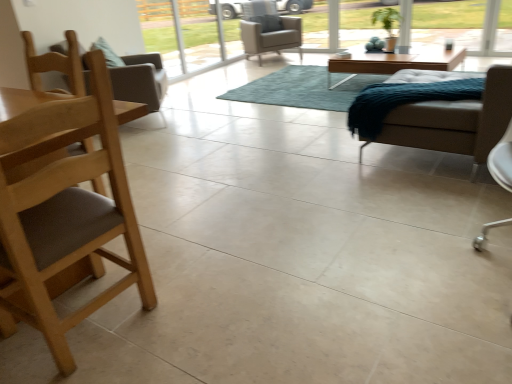
Question: Can you confirm if teal shaggy rug at center is smaller than light brown leather armchair at center, the 1th chair when ordered from back to front?

Choices:
 (A) yes
 (B) no

Answer: (A)

Question: Considering the relative positions of teal shaggy rug at center and light brown leather armchair at center, the fourth chair from the front, in the image provided, is teal shaggy rug at center to the right of light brown leather armchair at center, the fourth chair from the front, from the viewer's perspective?

Choices:
 (A) no
 (B) yes

Answer: (B)

Question: From a real-world perspective, is teal shaggy rug at center located higher than light brown leather armchair at center, the 1th chair when ordered from back to front?

Choices:
 (A) no
 (B) yes

Answer: (A)

Question: Considering the relative sizes of teal shaggy rug at center and light brown leather armchair at center, which is the first chair in top-to-bottom order, in the image provided, is teal shaggy rug at center wider than light brown leather armchair at center, which is the first chair in top-to-bottom order,?

Choices:
 (A) yes
 (B) no

Answer: (A)

Question: Is teal shaggy rug at center positioned with its back to light brown leather armchair at center, the fourth chair from the front?

Choices:
 (A) yes
 (B) no

Answer: (B)

Question: In terms of width, does brown wood chair at left, marked as the first chair in a front-to-back arrangement, look wider or thinner when compared to white leather chair at right, which appears as the third chair when viewed from the back?

Choices:
 (A) thin
 (B) wide

Answer: (A)

Question: From the image's perspective, is brown wood chair at left, which is the first chair in bottom-to-top order, located above or below white leather chair at right, which appears as the 2th chair when viewed from the front?

Choices:
 (A) below
 (B) above

Answer: (A)

Question: From their relative heights in the image, would you say brown wood chair at left, which appears as the 4th chair when viewed from the back, is taller or shorter than white leather chair at right, which is the 2th chair in bottom-to-top order?

Choices:
 (A) short
 (B) tall

Answer: (B)

Question: Is brown wood chair at left, marked as the 4th chair in a top-to-bottom arrangement, inside the boundaries of white leather chair at right, which appears as the third chair when viewed from the back, or outside?

Choices:
 (A) outside
 (B) inside

Answer: (A)

Question: Based on their positions, is light brown wooden coffee table at center located to the left or right of white leather chair at right, which appears as the 2th chair when viewed from the front?

Choices:
 (A) right
 (B) left

Answer: (A)

Question: From the image's perspective, is light brown wooden coffee table at center above or below white leather chair at right, arranged as the 3th chair when viewed from the top?

Choices:
 (A) below
 (B) above

Answer: (B)

Question: Considering the positions of light brown wooden coffee table at center and white leather chair at right, which appears as the 2th chair when viewed from the front, in the image, is light brown wooden coffee table at center taller or shorter than white leather chair at right, which appears as the 2th chair when viewed from the front,?

Choices:
 (A) tall
 (B) short

Answer: (B)

Question: Considering the positions of point click(358, 64) and point click(501, 84), is point click(358, 64) closer or farther from the camera than point click(501, 84)?

Choices:
 (A) closer
 (B) farther

Answer: (B)

Question: In terms of width, does teal shaggy rug at center look wider or thinner when compared to white leather chair at right, which is the 2th chair in bottom-to-top order?

Choices:
 (A) thin
 (B) wide

Answer: (B)

Question: In terms of size, does teal shaggy rug at center appear bigger or smaller than white leather chair at right, which appears as the 2th chair when viewed from the front?

Choices:
 (A) small
 (B) big

Answer: (B)